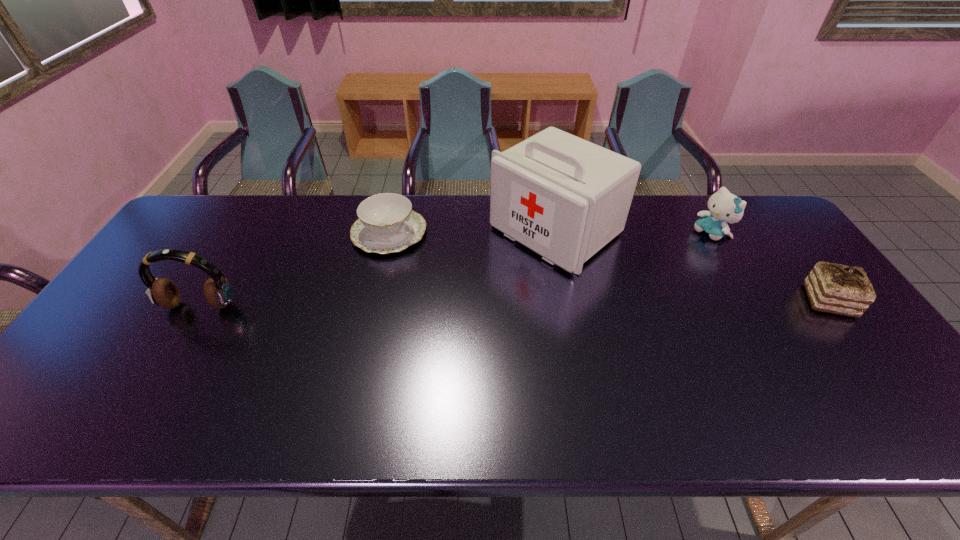
I want to click on unoccupied area between the chinaware and the tallest object, so click(x=472, y=232).

Where is `vacant space that's between the third object from right to left and the kitten`? vacant space that's between the third object from right to left and the kitten is located at coordinates (635, 232).

Find the location of a particular element. The image size is (960, 540). blank region between the rightmost object and the second object from right to left is located at coordinates (771, 267).

Where is `empty space between the leftmost object and the rightmost object`? Image resolution: width=960 pixels, height=540 pixels. empty space between the leftmost object and the rightmost object is located at coordinates point(515,303).

You are a GUI agent. You are given a task and a screenshot of the screen. Output one action in this format:
    pyautogui.click(x=<x>, y=<y>)
    Task: Click on the vacant space that's between the chocolate cake and the kitten
    The height and width of the screenshot is (540, 960).
    Given the screenshot: What is the action you would take?
    pyautogui.click(x=771, y=267)

Where is `unoccupied area between the third object from right to left and the headset`? unoccupied area between the third object from right to left and the headset is located at coordinates (378, 268).

Where is `free area in between the chocolate cake and the third object from right to left`? The height and width of the screenshot is (540, 960). free area in between the chocolate cake and the third object from right to left is located at coordinates (692, 266).

Image resolution: width=960 pixels, height=540 pixels. What are the coordinates of `vacant space that is in between the first-aid kit and the chocolate cake` in the screenshot? It's located at (692, 266).

Locate an element on the screen. free space between the third shortest object and the tallest object is located at coordinates (635, 232).

Identify the location of object that ranks as the fourth closest to the chinaware. The width and height of the screenshot is (960, 540). (834, 288).